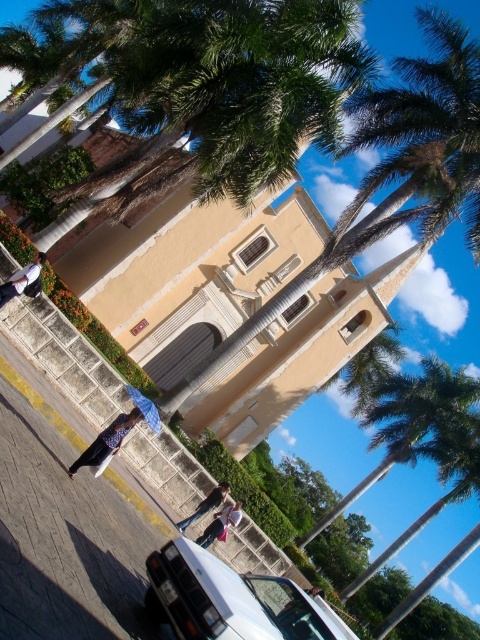
You are a delivery person standing on the street. You need to load a package onto the white glossy car at lower left and the dark blue jeans at lower center. Which object is taller so that you can decide where to place the heavier items?

The white glossy car at lower left is taller than the dark blue jeans at lower center, so you should place the heavier items on the white glossy car at lower left.

You are a delivery person who needs to place a package on the ground near the leather jacket at lower left. According to the scene description, where exactly should you place the package?

The package should be placed at the coordinates point (107, 440) where the leather jacket at lower left is located.

You are a fashion designer examining two jackets in a photo. You see a leather jacket at lower left and a denim jacket at lower center. Which jacket would you say is bigger in size?

The leather jacket at lower left is larger in size compared to the denim jacket at lower center.